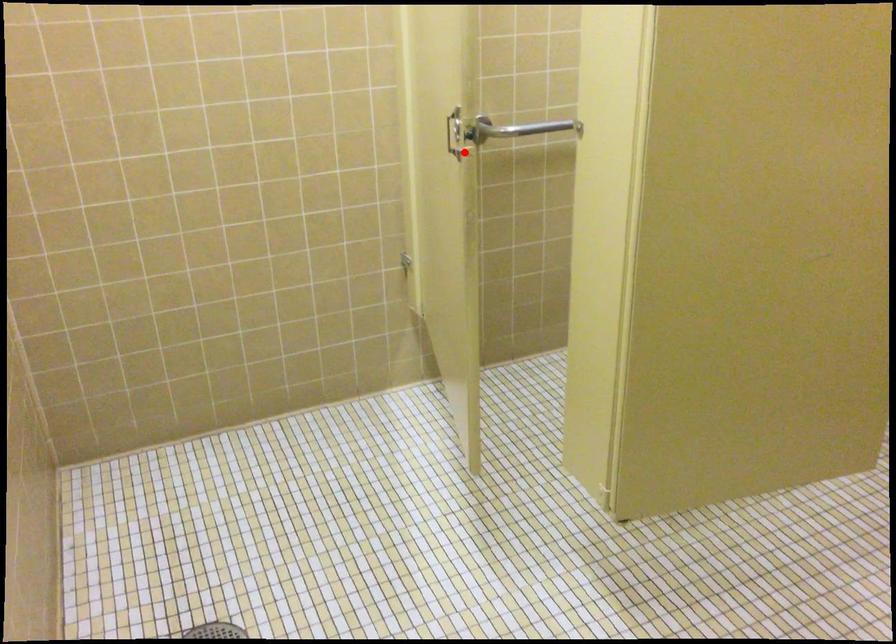
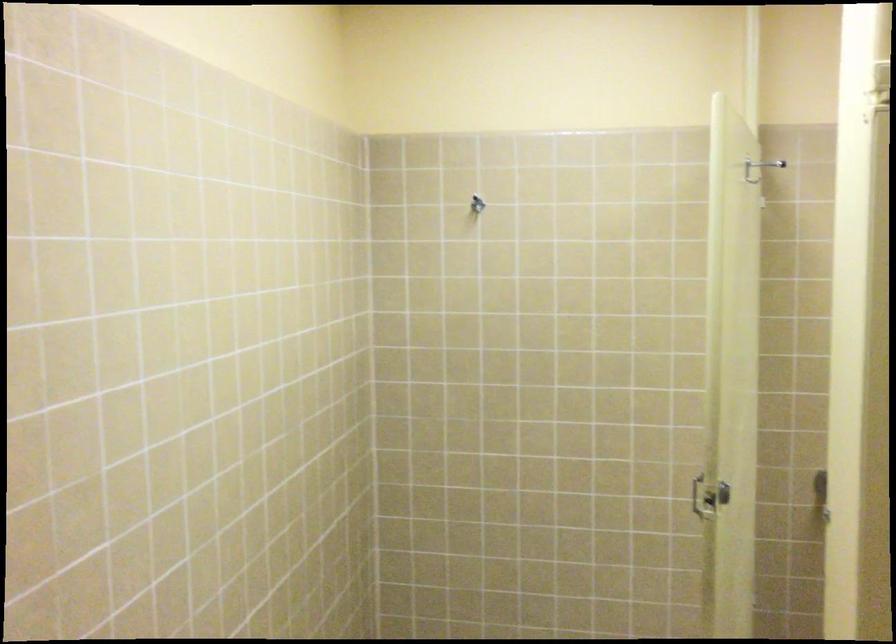
Where in the second image is the point corresponding to the highlighted location from the first image?

(708, 497)